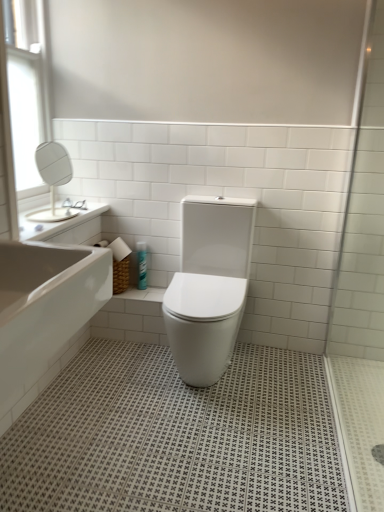
Locate an element on the screen. The width and height of the screenshot is (384, 512). vacant area situated below white glossy sink at upper left (from a real-world perspective) is located at coordinates (54, 215).